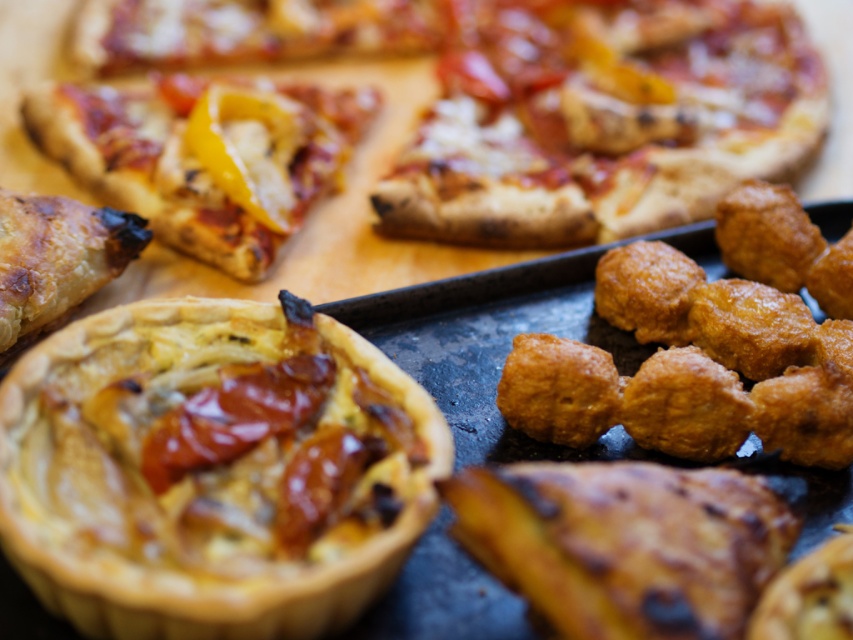
Question: Which point appears farthest from the camera in this image?

Choices:
 (A) (128, 100)
 (B) (64, 269)
 (C) (569, 488)

Answer: (A)

Question: Among these objects, which one is farthest from the camera?

Choices:
 (A) golden brown flaky pastry at lower left
 (B) golden flaky tartlet at center
 (C) tomato sauce pizza at upper center
 (D) golden brown crusty pizza at upper center

Answer: (C)

Question: Which point is farther from the camera taking this photo?

Choices:
 (A) (154, 193)
 (B) (556, 132)

Answer: (B)

Question: From the image, what is the correct spatial relationship of golden brown flaky pastry at lower right in relation to golden-brown crispy pizza slice at upper left?

Choices:
 (A) right
 (B) left

Answer: (A)

Question: Can you confirm if golden brown crusty pizza at upper center is thinner than tomato sauce pizza at upper center?

Choices:
 (A) yes
 (B) no

Answer: (B)

Question: Is golden brown crusty pizza at upper center to the right of golden brown flaky pastry at lower left from the viewer's perspective?

Choices:
 (A) no
 (B) yes

Answer: (B)